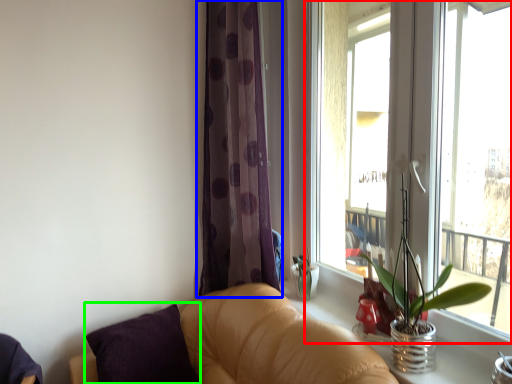
Question: Which is farther away from window (highlighted by a red box)? curtain (highlighted by a blue box) or pillow (highlighted by a green box)?

Choices:
 (A) curtain
 (B) pillow

Answer: (B)